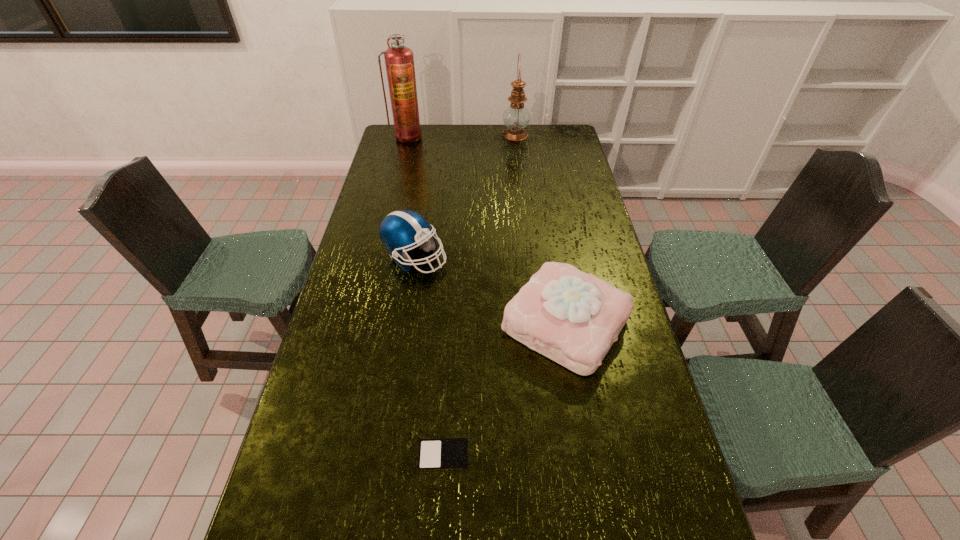
This screenshot has height=540, width=960. I want to click on vacant position in the image that satisfies the following two spatial constraints: 1. on the side of the fire extinguisher with the label; 2. on the left side of the second shortest object, so click(361, 324).

This screenshot has height=540, width=960. In order to click on free space that satisfies the following two spatial constraints: 1. at the front of the third shortest object with the faceguard; 2. on the back side of the cake in this screenshot , I will do `click(404, 324)`.

Identify the location of vacant position in the image that satisfies the following two spatial constraints: 1. on the side of the fire extinguisher with the label; 2. on the left side of the cake. This screenshot has width=960, height=540. (361, 324).

This screenshot has width=960, height=540. Identify the location of free space that satisfies the following two spatial constraints: 1. at the front of the third shortest object with the faceguard; 2. on the left side of the fourth tallest object. (404, 324).

You are a GUI agent. You are given a task and a screenshot of the screen. Output one action in this format:
    pyautogui.click(x=<x>, y=<y>)
    Task: Click on the vacant space that satisfies the following two spatial constraints: 1. on the side of the fire extinguisher with the label; 2. on the right side of the shortest object
    This screenshot has height=540, width=960.
    Given the screenshot: What is the action you would take?
    pyautogui.click(x=329, y=456)

Where is `free space that satisfies the following two spatial constraints: 1. on the front side of the second tallest object; 2. at the front of the third tallest object with the faceguard`? Image resolution: width=960 pixels, height=540 pixels. free space that satisfies the following two spatial constraints: 1. on the front side of the second tallest object; 2. at the front of the third tallest object with the faceguard is located at coordinates (x=530, y=258).